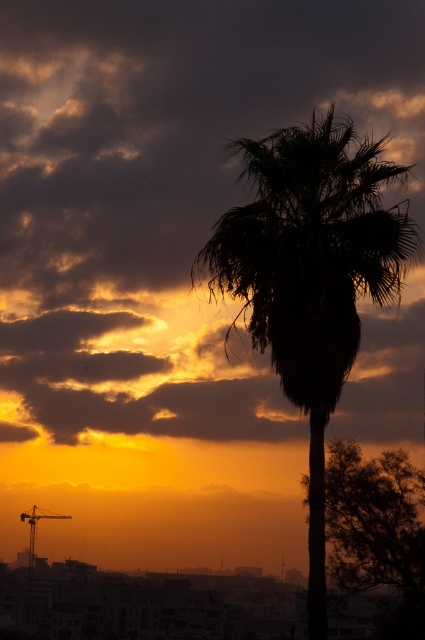
Is the position of orange/yellow cloud at upper center more distant than that of silky brown tree at center?

Yes.

Does orange/yellow cloud at upper center have a lesser height compared to silky brown tree at center?

No.

Between point (193, 170) and point (393, 490), which one is positioned behind?

Point (193, 170)

Image resolution: width=425 pixels, height=640 pixels. I want to click on orange/yellow cloud at upper center, so click(x=163, y=195).

Does silhouette leafy palm at center have a greater width compared to silky brown tree at center?

Correct, the width of silhouette leafy palm at center exceeds that of silky brown tree at center.

Does silhouette leafy palm at center have a greater height compared to silky brown tree at center?

Indeed, silhouette leafy palm at center has a greater height compared to silky brown tree at center.

Find the location of a particular element. This screenshot has width=425, height=640. silhouette leafy palm at center is located at coordinates (311, 275).

Image resolution: width=425 pixels, height=640 pixels. In order to click on silhouette leafy palm at center in this screenshot , I will do `click(311, 275)`.

Does orange/yellow cloud at upper center have a larger size compared to silhouette leafy palm at center?

Yes.

Is the position of orange/yellow cloud at upper center less distant than that of silhouette leafy palm at center?

That is False.

Who is more forward, (130, 412) or (212, 275)?

Point (212, 275) is in front.

Identify the location of orange/yellow cloud at upper center. (163, 195).